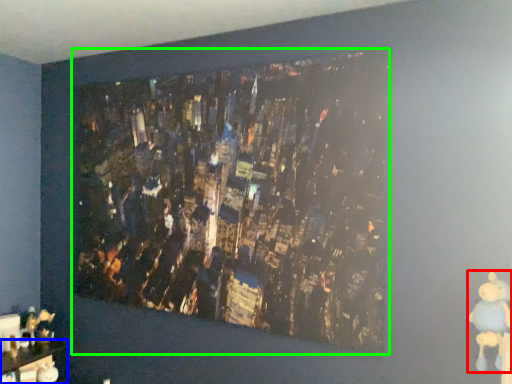
Question: Which object is positioned closest to toy (highlighted by a red box)? Select from furniture (highlighted by a blue box) and picture frame (highlighted by a green box).

Choices:
 (A) furniture
 (B) picture frame

Answer: (B)